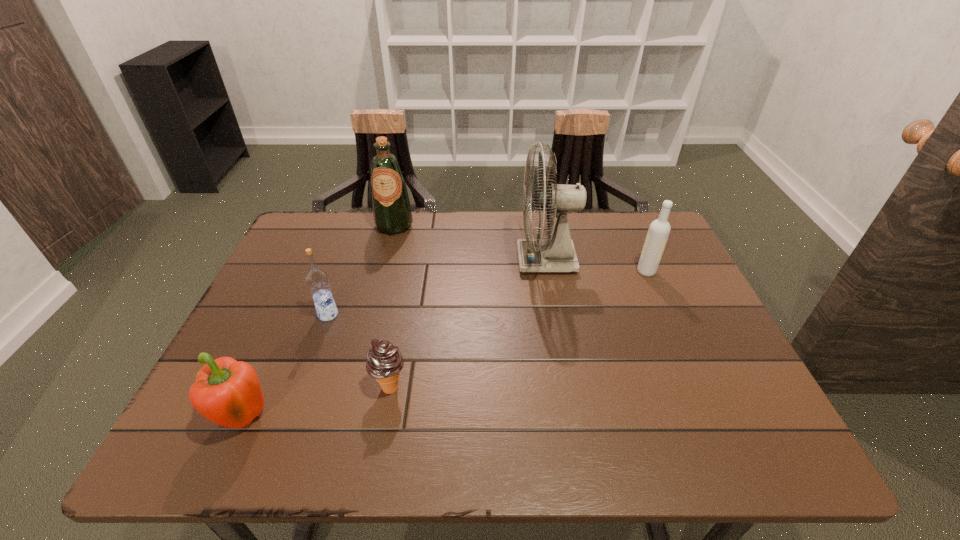
Find the location of a particular element. blank space that satisfies the following two spatial constraints: 1. on the front-facing side of the icecream; 2. on the left side of the olive oil is located at coordinates (352, 387).

Where is `vacant region that satisfies the following two spatial constraints: 1. on the front-facing side of the icecream; 2. on the left side of the fifth shortest object`? vacant region that satisfies the following two spatial constraints: 1. on the front-facing side of the icecream; 2. on the left side of the fifth shortest object is located at coordinates (352, 387).

What are the coordinates of `free point that satisfies the following two spatial constraints: 1. on the front-facing side of the right vodka; 2. on the right side of the fan` in the screenshot? It's located at (548, 271).

Find the location of `free space that satisfies the following two spatial constraints: 1. on the front-facing side of the farther vodka; 2. on the left side of the second object from right to left`. free space that satisfies the following two spatial constraints: 1. on the front-facing side of the farther vodka; 2. on the left side of the second object from right to left is located at coordinates (548, 271).

Identify the location of free location that satisfies the following two spatial constraints: 1. on the front-facing side of the fan; 2. on the back side of the rightmost object. The height and width of the screenshot is (540, 960). (548, 271).